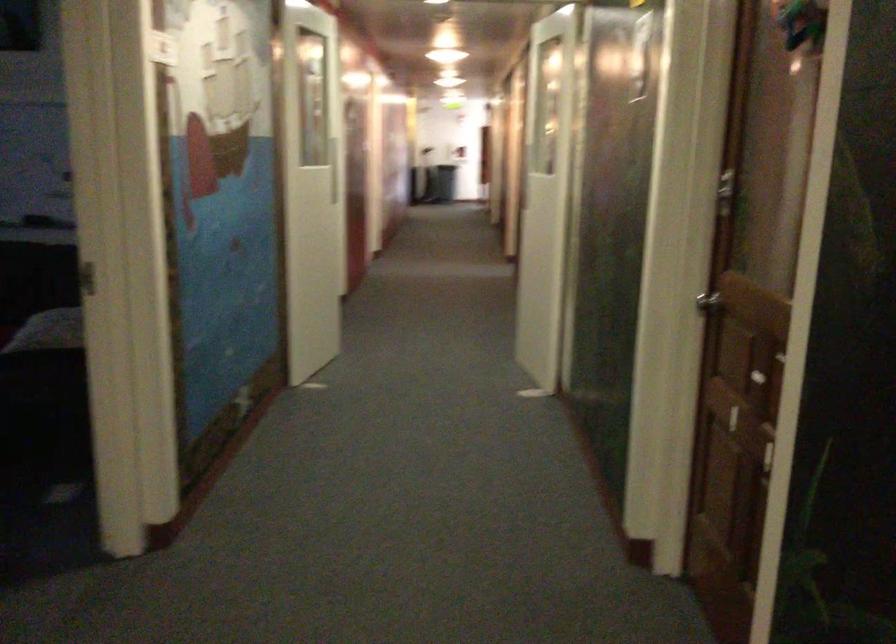
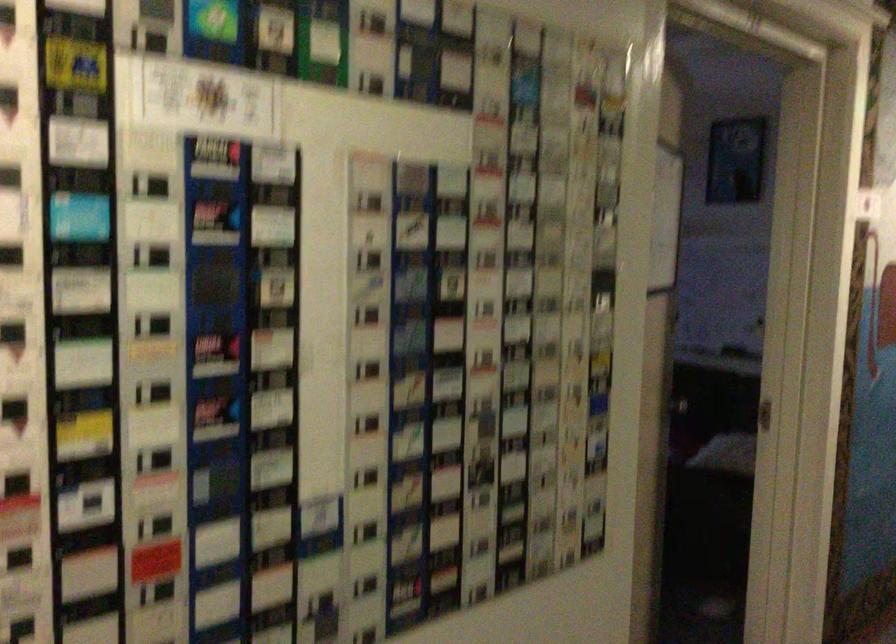
Question: Based on the continuous images, in which direction is the camera rotating? Reply with the corresponding letter.

Choices:
 (A) Left
 (B) Right
 (C) Up
 (D) Down

Answer: (A)